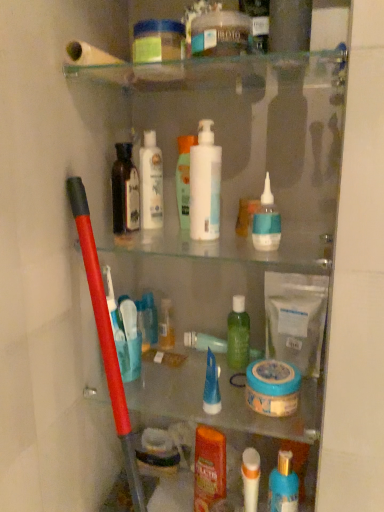
Question: From the image's perspective, is green translucent bottle at center, which ranks as the fourth toiletry in right-to-left order, located beneath dark brown glass bottle at upper left, the 1th toiletry in the left-to-right sequence?

Choices:
 (A) yes
 (B) no

Answer: (A)

Question: Is green translucent bottle at center, acting as the seventh toiletry starting from the left, positioned with its back to dark brown glass bottle at upper left, the 1th toiletry in the left-to-right sequence?

Choices:
 (A) no
 (B) yes

Answer: (A)

Question: Can you confirm if green translucent bottle at center, acting as the seventh toiletry starting from the left, is bigger than dark brown glass bottle at upper left, the 1th toiletry in the left-to-right sequence?

Choices:
 (A) no
 (B) yes

Answer: (B)

Question: Is green translucent bottle at center, which ranks as the fourth toiletry in right-to-left order, positioned before dark brown glass bottle at upper left, the 1th toiletry in the left-to-right sequence?

Choices:
 (A) no
 (B) yes

Answer: (A)

Question: Is green translucent bottle at center, which ranks as the fourth toiletry in right-to-left order, outside of dark brown glass bottle at upper left, the 1th toiletry in the left-to-right sequence?

Choices:
 (A) no
 (B) yes

Answer: (B)

Question: Would you say blue gel tube at center, which is counted as the 5th toiletry, starting from the left, is inside or outside dark brown glass bottle at upper left, the 1th toiletry in the left-to-right sequence?

Choices:
 (A) outside
 (B) inside

Answer: (A)

Question: Would you say blue gel tube at center, the sixth toiletry from the right, is to the left or to the right of dark brown glass bottle at upper left, the 1th toiletry in the left-to-right sequence, in the picture?

Choices:
 (A) left
 (B) right

Answer: (B)

Question: Considering the positions of blue gel tube at center, the sixth toiletry from the right, and dark brown glass bottle at upper left, the 1th toiletry in the left-to-right sequence, in the image, is blue gel tube at center, the sixth toiletry from the right, taller or shorter than dark brown glass bottle at upper left, the 1th toiletry in the left-to-right sequence,?

Choices:
 (A) tall
 (B) short

Answer: (B)

Question: From a real-world perspective, is blue gel tube at center, which is counted as the 5th toiletry, starting from the left, above or below dark brown glass bottle at upper left, acting as the 10th toiletry starting from the right?

Choices:
 (A) above
 (B) below

Answer: (B)

Question: Based on their sizes in the image, would you say orange plastic shampoo at center, the sixth toiletry from the left, is bigger or smaller than white glossy lotion at center, arranged as the second toiletry when viewed from the left?

Choices:
 (A) big
 (B) small

Answer: (A)

Question: In the image, is orange plastic shampoo at center, the sixth toiletry from the left, positioned in front of or behind white glossy lotion at center, the ninth toiletry positioned from the right?

Choices:
 (A) behind
 (B) front

Answer: (B)

Question: From a real-world perspective, is orange plastic shampoo at center, the sixth toiletry from the left, above or below white glossy lotion at center, the ninth toiletry positioned from the right?

Choices:
 (A) above
 (B) below

Answer: (B)

Question: From the image's perspective, is orange plastic shampoo at center, the sixth toiletry from the left, positioned above or below white glossy lotion at center, the ninth toiletry positioned from the right?

Choices:
 (A) above
 (B) below

Answer: (B)

Question: In terms of width, does white glossy mouthwash at center, arranged as the second mouthwash when ordered from the bottom, look wider or thinner when compared to white matte toothbrush at lower center, arranged as the 3th toiletry when viewed from the right?

Choices:
 (A) thin
 (B) wide

Answer: (A)

Question: Does point (183, 219) appear closer or farther from the camera than point (248, 503)?

Choices:
 (A) closer
 (B) farther

Answer: (A)